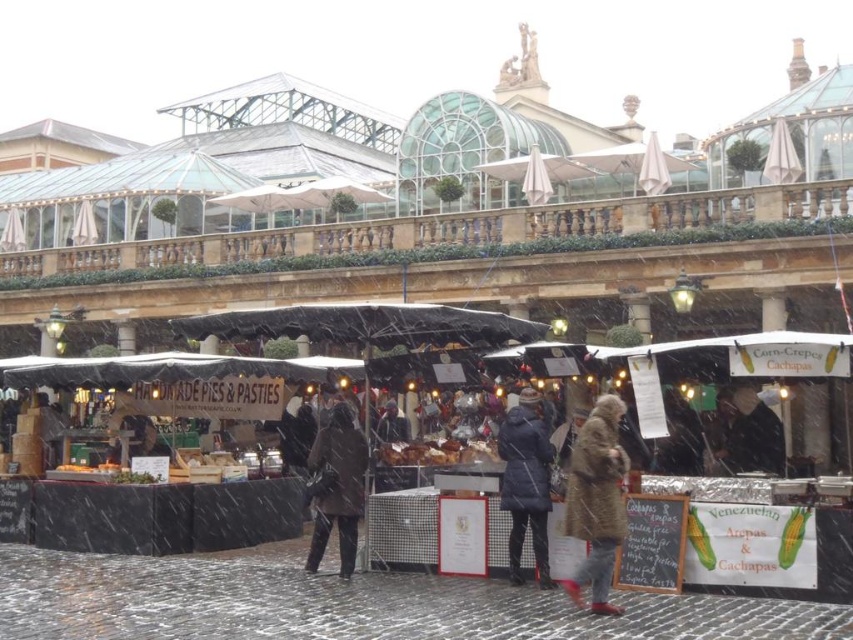
You are a customer at the market and want to locate both the dark blue fabric coat at center and the brown wool coat at center. Which one is positioned to the left?

The brown wool coat at center is positioned to the left of the dark blue fabric coat at center.

You are a customer at the market and want to buy a coat. You see the matte black tent at center and the dark blue fabric coat at center. Which object is closer to you?

The matte black tent at center is closer to you because it is in front of the dark blue fabric coat at center.